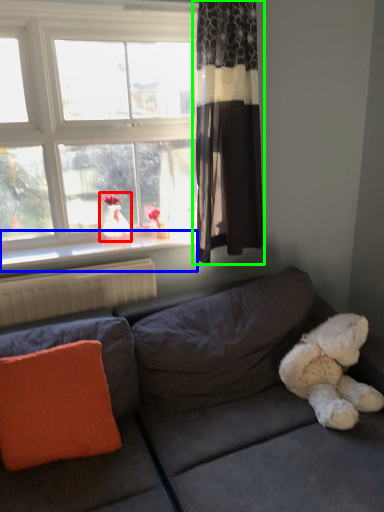
Question: Which object is positioned closest to doll (highlighted by a red box)? Select from window sill (highlighted by a blue box) and curtain (highlighted by a green box).

Choices:
 (A) window sill
 (B) curtain

Answer: (A)